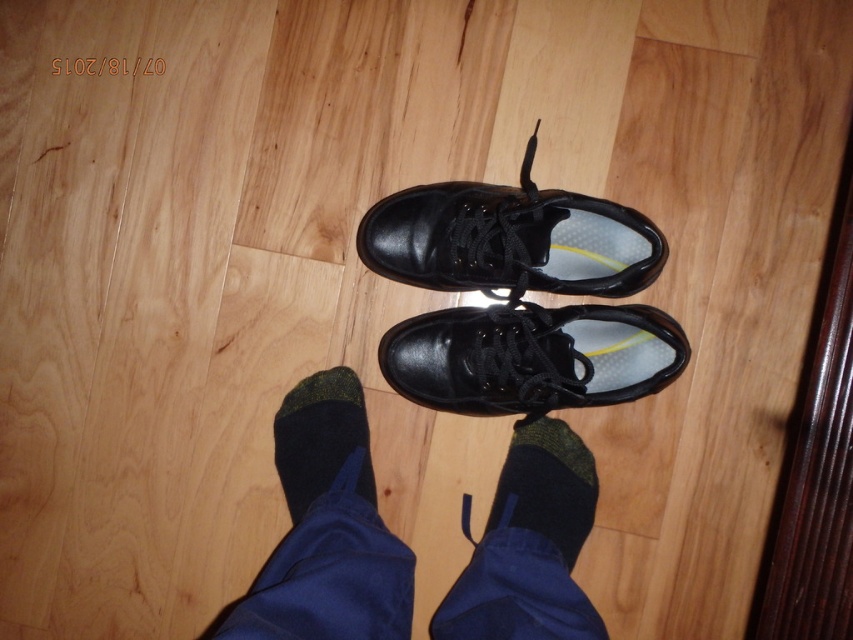
You are trying to put on your socks and shoes. You have a black leather shoe at center and a dark green knit sock at center. Which item should you put on first according to their sizes?

The dark green knit sock at center should be put on first since it is smaller than the black leather shoe at center, allowing it to fit inside the shoe.

You are a delivery person who needs to deliver a package to the person whose feet are visible in the image. The package is too large to place between the black leather socks at lower center and the shiny black shoe at center. Where should you place the package instead?

The black leather socks at lower center are located below the shiny black shoe at center, so the package should be placed either to the side of both objects or behind them to ensure there is enough space.

Looking at this image, you are trying to put on your shoes but notice that the black leather shoe at center and the dark green knit sock at center are in the way. Which item should you move first to make space?

The black leather shoe at center is in front of the dark green knit sock at center, so you should move the black leather shoe at center first to access the sock underneath.